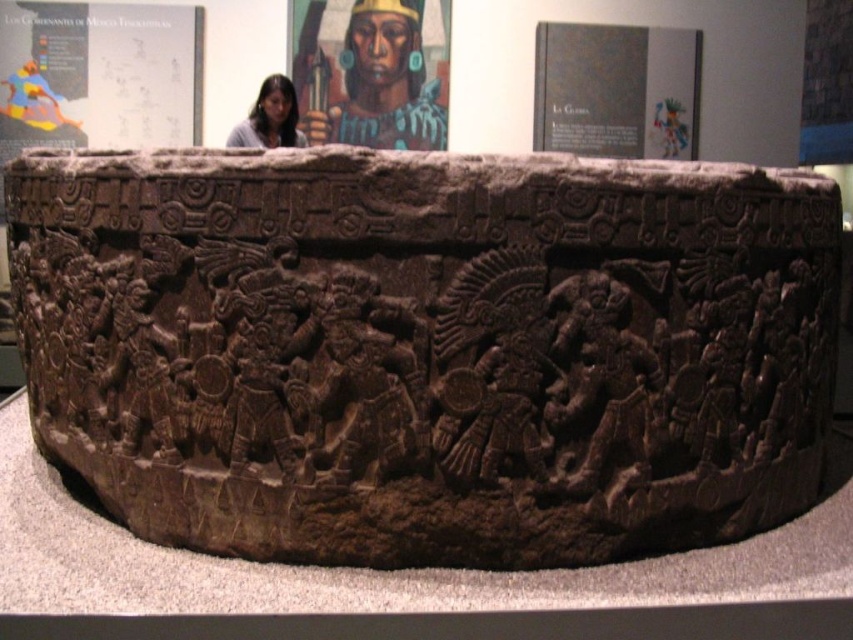
Can you confirm if matte brown face at upper center is positioned to the left of smooth skin face at upper center?

In fact, matte brown face at upper center is to the right of smooth skin face at upper center.

Can you confirm if matte brown face at upper center is positioned to the right of smooth skin face at upper center?

Correct, you'll find matte brown face at upper center to the right of smooth skin face at upper center.

Between point (407, 83) and point (253, 140), which one is positioned behind?

Point (407, 83)

The image size is (853, 640). In order to click on matte brown face at upper center in this screenshot , I will do `click(387, 81)`.

Which of these two, brown carved stone at center or smooth skin face at upper center, stands taller?

Standing taller between the two is brown carved stone at center.

Which of these two, brown carved stone at center or smooth skin face at upper center, stands shorter?

With less height is smooth skin face at upper center.

Describe the element at coordinates (427, 348) in the screenshot. I see `brown carved stone at center` at that location.

Find the location of `brown carved stone at center`. brown carved stone at center is located at coordinates (427, 348).

Which is below, brown carved stone at center or matte brown face at upper center?

Positioned lower is brown carved stone at center.

Locate an element on the screen. This screenshot has width=853, height=640. brown carved stone at center is located at coordinates (427, 348).

What are the coordinates of `brown carved stone at center` in the screenshot? It's located at (427, 348).